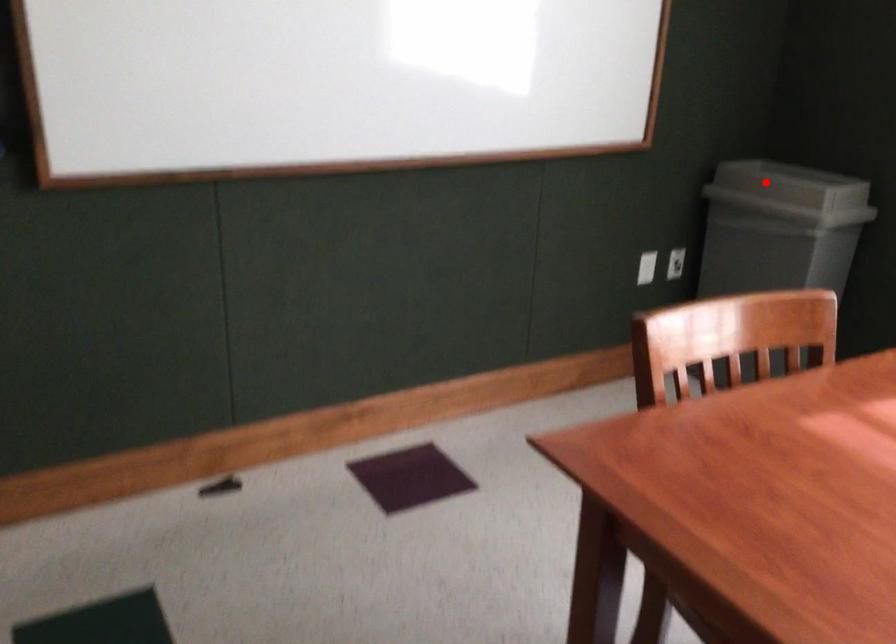
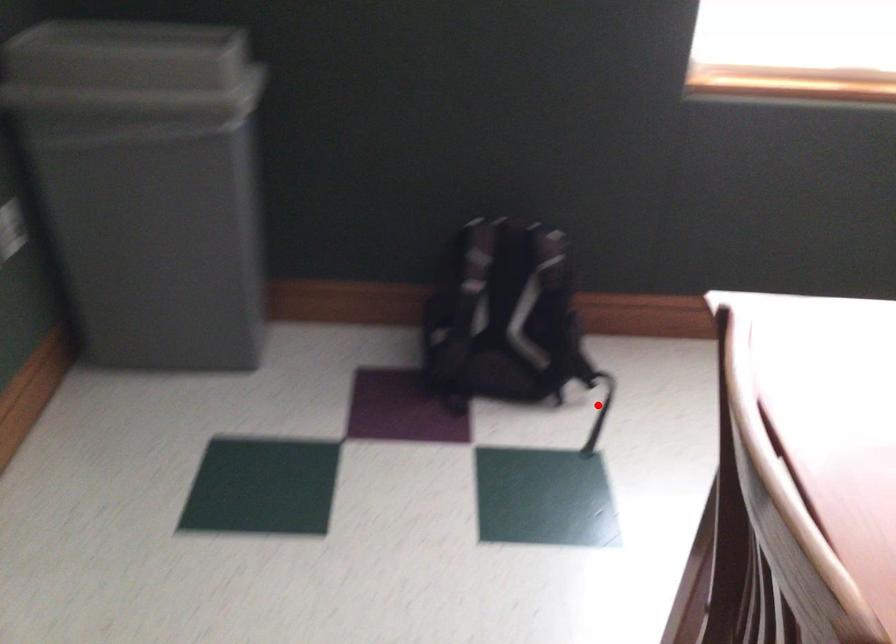
I am providing you with two images of the same scene from different viewpoints. A red point is marked on the first image and another point is marked on the second image. Do the highlighted points in image1 and image2 indicate the same real-world spot?

No